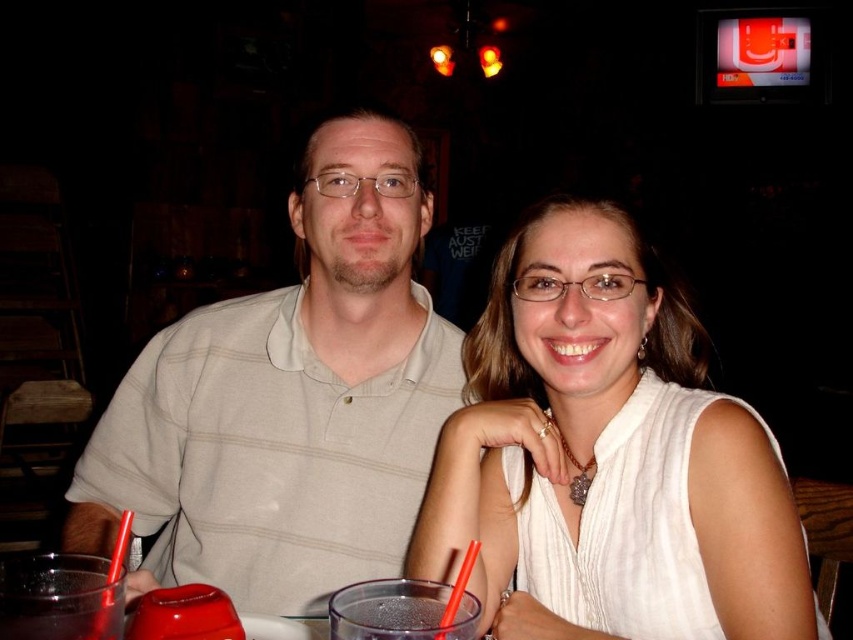
Between white silk blouse at center and light beige striped polo shirt at center, which one is positioned higher?

light beige striped polo shirt at center is higher up.

Is white silk blouse at center further to camera compared to light beige striped polo shirt at center?

No, white silk blouse at center is closer to the viewer.

Is point (445, 483) in front of point (178, 460)?

That is True.

What are the coordinates of `white silk blouse at center` in the screenshot? It's located at (607, 458).